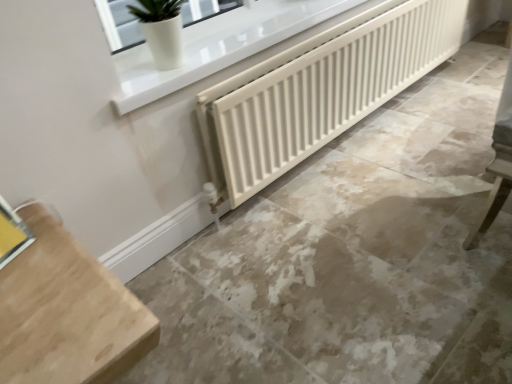
Question: Is point (116, 334) positioned closer to the camera than point (416, 18)?

Choices:
 (A) closer
 (B) farther

Answer: (A)

Question: From a real-world perspective, relative to white matte radiator at center, is light wood table at lower left vertically above or below?

Choices:
 (A) below
 (B) above

Answer: (A)

Question: Which object is the farthest from the white matte radiator at center?

Choices:
 (A) yellow cardboard at lower left, which is the first window in bottom-to-top order
 (B) beige marble floor at center
 (C) white glossy pot at upper left, the 2th window ordered from the bottom
 (D) light wood table at lower left

Answer: (A)

Question: Which object is positioned farthest from the white glossy pot at upper left, the 2th window from the left?

Choices:
 (A) light wood table at lower left
 (B) yellow cardboard at lower left, which is the first window in bottom-to-top order
 (C) white matte radiator at center
 (D) beige marble floor at center

Answer: (A)